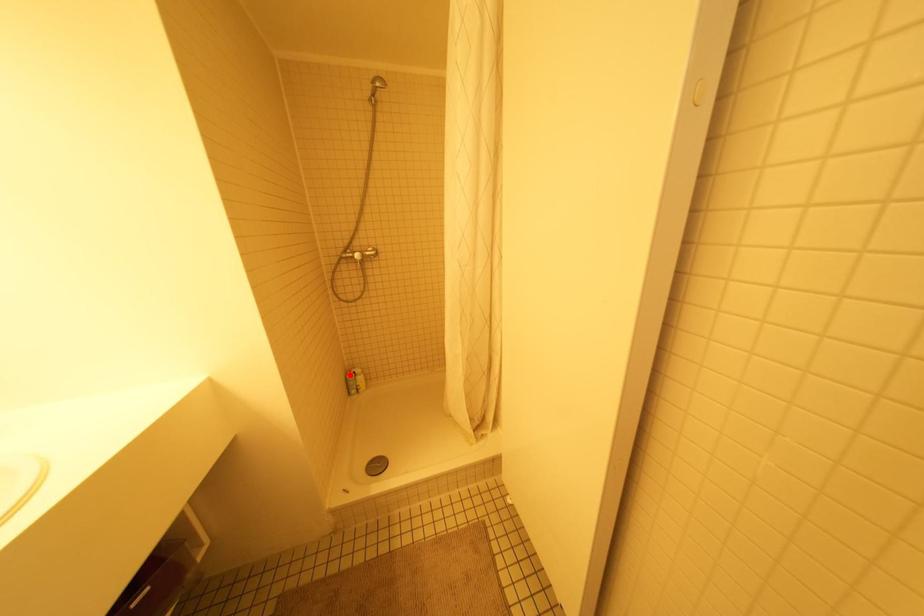
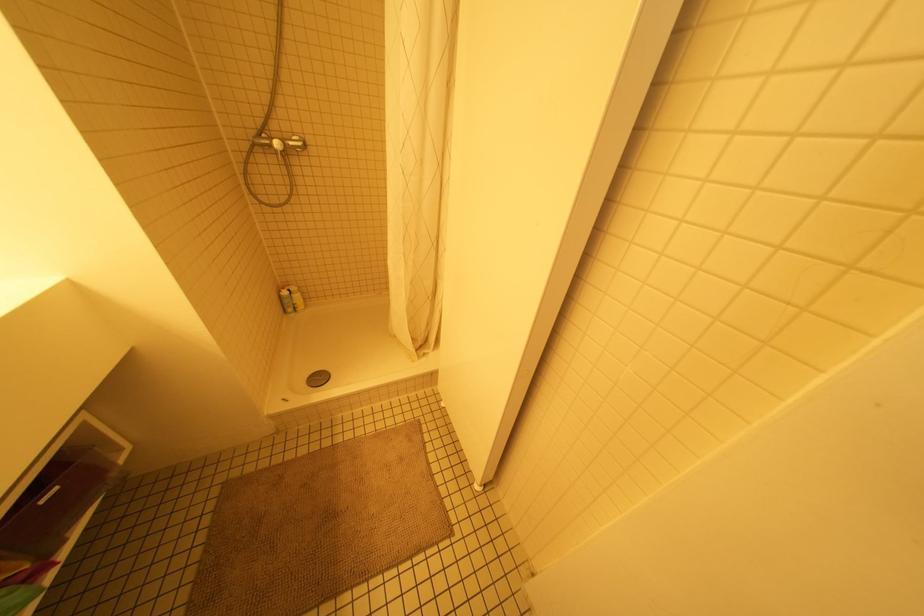
Locate, in the second image, the point that corresponds to the highlighted location in the first image.

(284, 292)